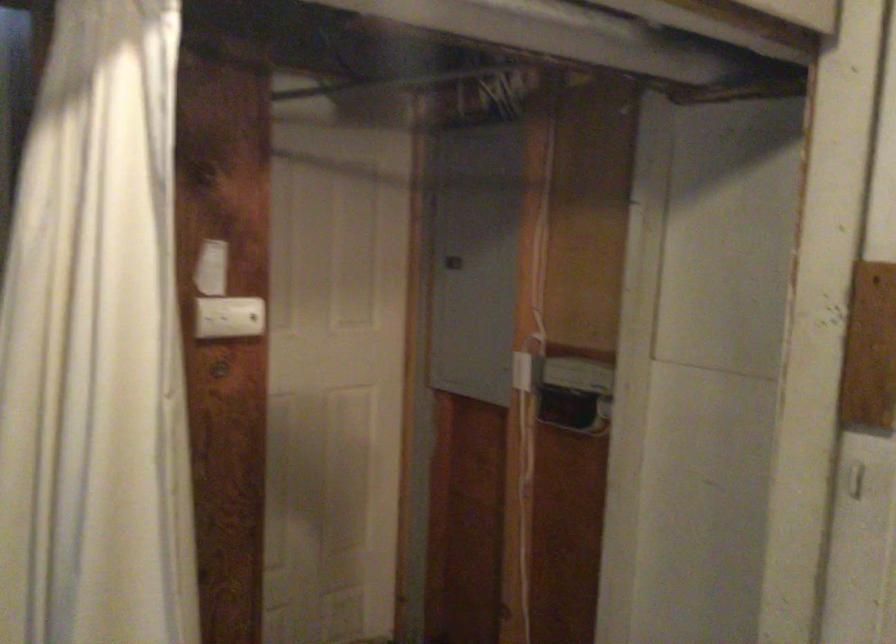
Based on the continuous images, in which direction is the camera rotating?

The rotation direction of the camera is left-down.